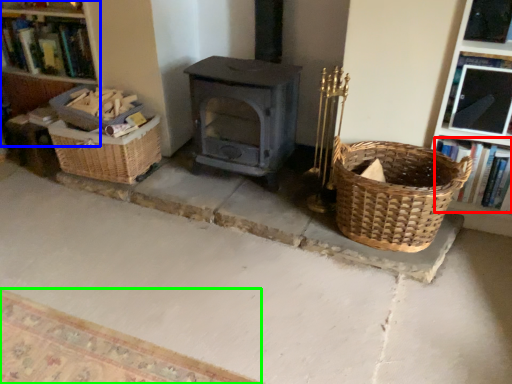
Question: Based on their relative distances, which object is farther from book (highlighted by a red box)? Choose from bookshelf (highlighted by a blue box) and mat (highlighted by a green box).

Choices:
 (A) bookshelf
 (B) mat

Answer: (A)